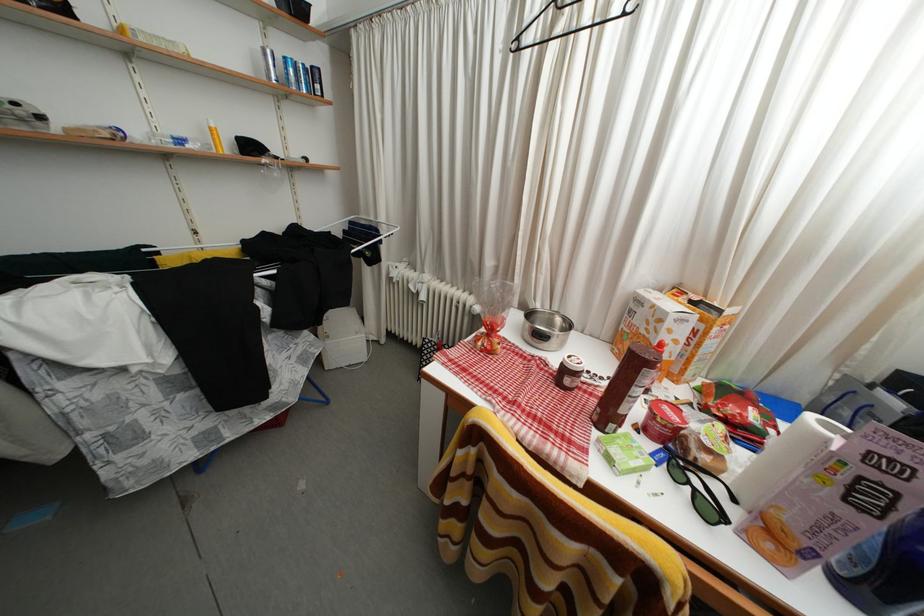
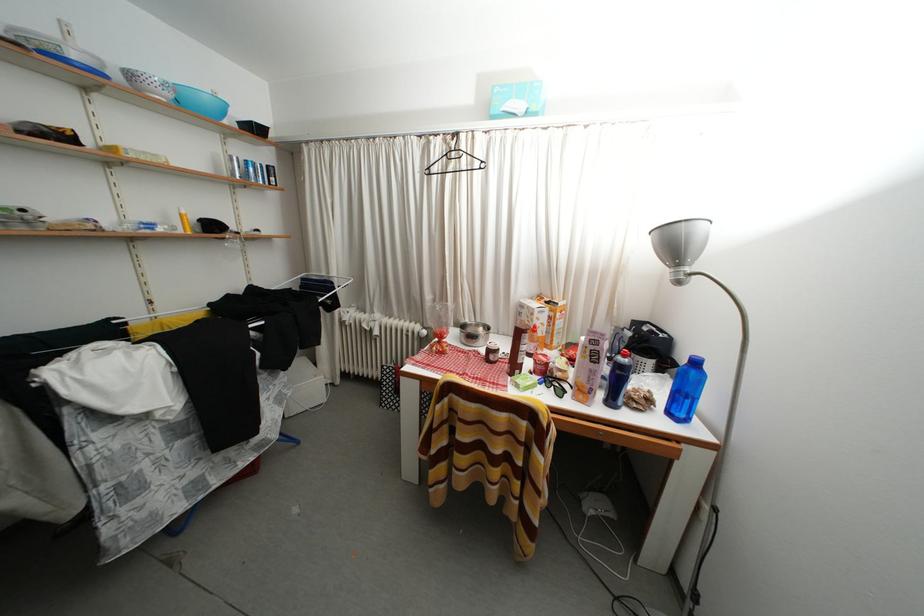
The point at (683,456) is marked in the first image. Where is the corresponding point in the second image?

(554, 381)